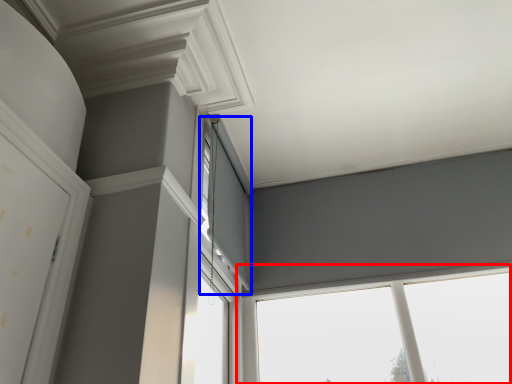
Question: Among these objects, which one is nearest to the camera, window (highlighted by a red box) or window (highlighted by a blue box)?

Choices:
 (A) window
 (B) window

Answer: (B)